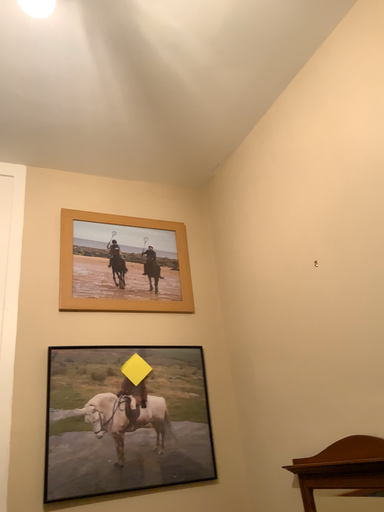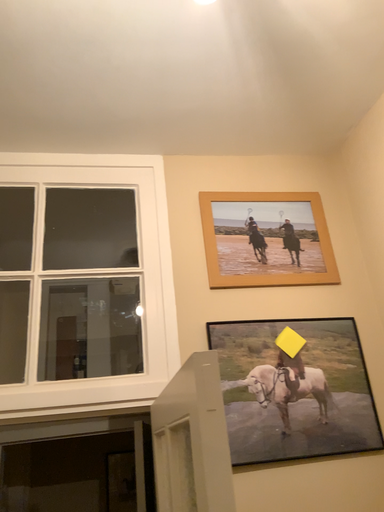
Question: How did the camera likely rotate when shooting the video?

Choices:
 (A) rotated right
 (B) rotated left

Answer: (B)